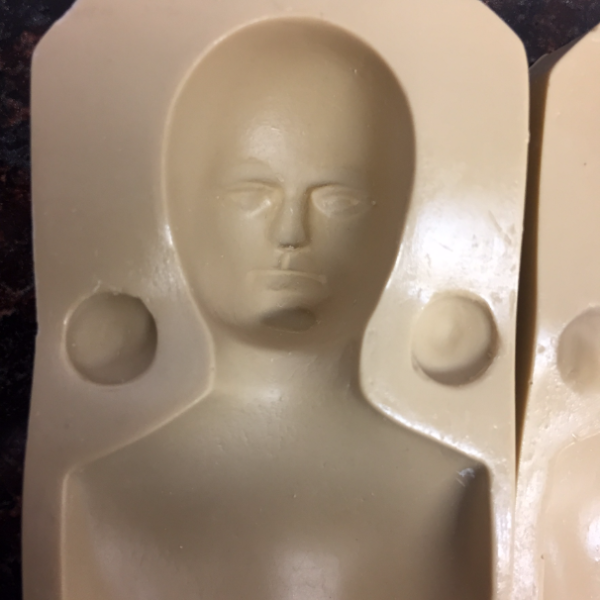
The height and width of the screenshot is (600, 600). Find the location of `art`. art is located at coordinates (413, 420).